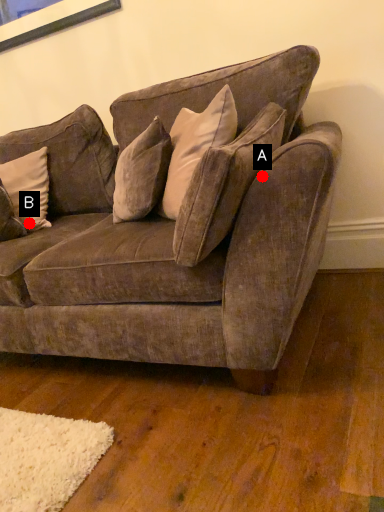
Question: Two points are circled on the image, labeled by A and B beside each circle. Which of the following is the closest to the observer?

Choices:
 (A) A is closer
 (B) B is closer

Answer: (A)